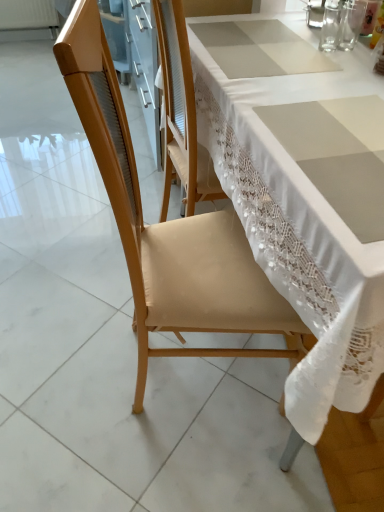
Question: In terms of width, does transparent glass at upper right, arranged as the 2th tableware when viewed from the right, look wider or thinner when compared to transparent glass at upper right, marked as the 3th tableware in a left-to-right arrangement?

Choices:
 (A) wide
 (B) thin

Answer: (A)

Question: Based on their positions, is transparent glass at upper right, the 2th tableware positioned from the left, located to the left or right of transparent glass at upper right, the 1th tableware from the right?

Choices:
 (A) left
 (B) right

Answer: (A)

Question: Which object is the closest to the transparent glass at upper right, marked as the 3th tableware in a left-to-right arrangement?

Choices:
 (A) transparent glass at upper right, the 2th tableware positioned from the left
 (B) clear glass at upper right, which appears as the 3th tableware when viewed from the right

Answer: (A)

Question: Which object is positioned closest to the transparent glass at upper right, the 2th tableware positioned from the left?

Choices:
 (A) transparent glass at upper right, the 1th tableware from the right
 (B) clear glass at upper right, which appears as the 3th tableware when viewed from the right

Answer: (A)